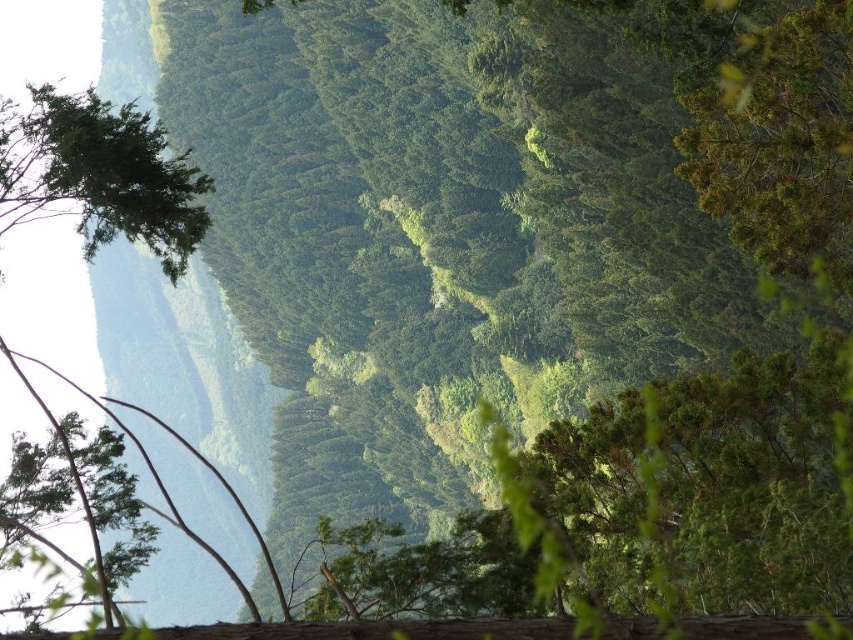
Consider the image. Between green leafy tree at upper left and green leafy tree at left, which one is positioned lower?

green leafy tree at left is lower down.

Can you confirm if green leafy tree at upper left is positioned to the left of green leafy tree at left?

Indeed, green leafy tree at upper left is positioned on the left side of green leafy tree at left.

Find the location of a particular element. This screenshot has width=853, height=640. green leafy tree at upper left is located at coordinates (99, 173).